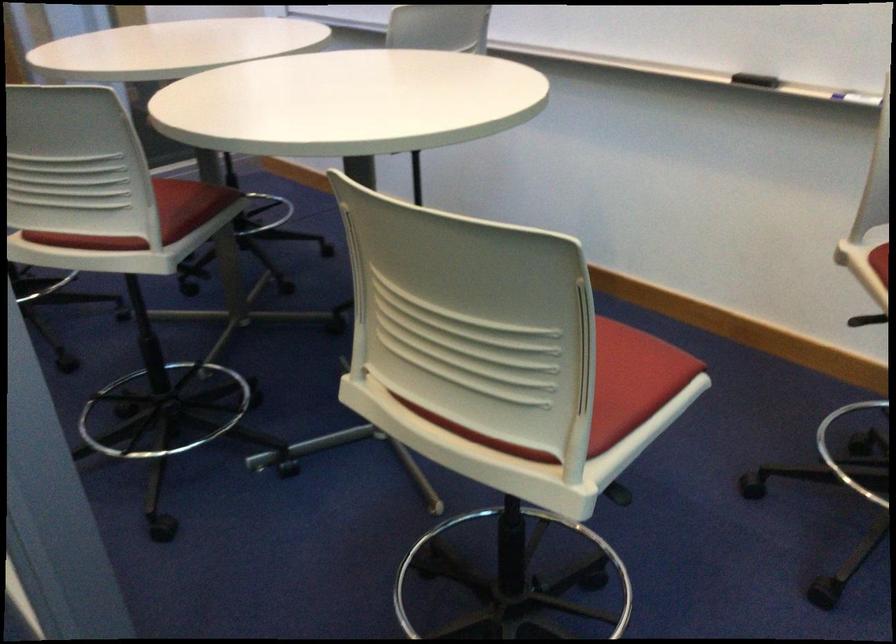
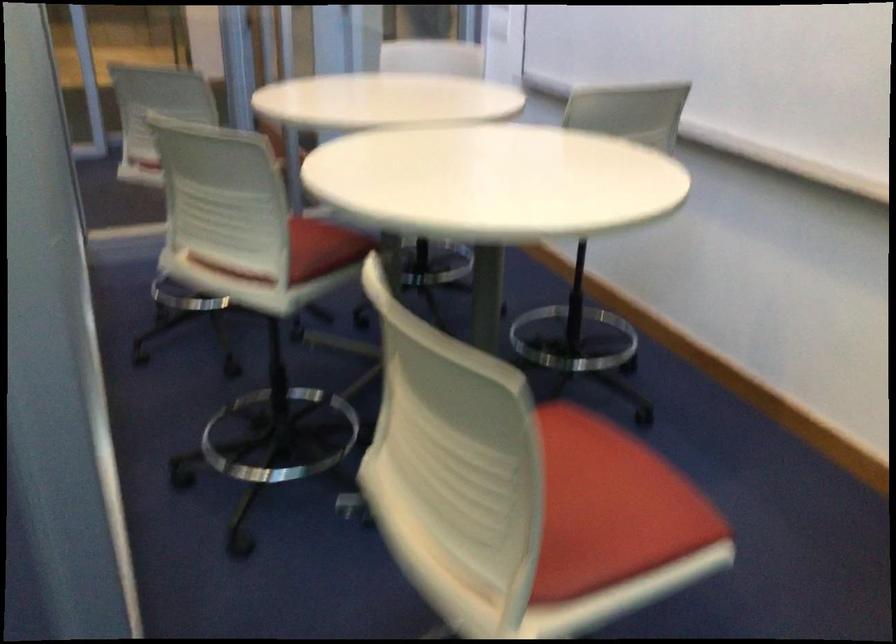
Locate, in the second image, the point that corresponds to (599,365) in the first image.

(609, 507)